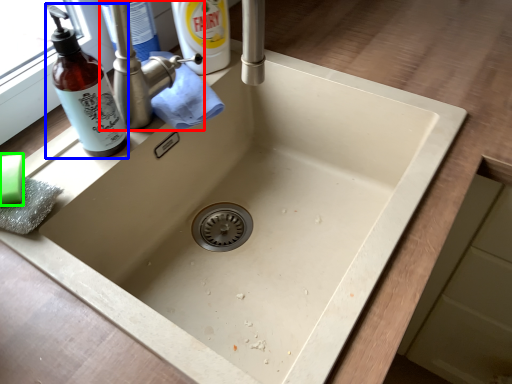
Question: Estimate the real-world distances between objects in this image. Which object is closer to tap (highlighted by a red box), bottle (highlighted by a blue box) or soap (highlighted by a green box)?

Choices:
 (A) bottle
 (B) soap

Answer: (A)